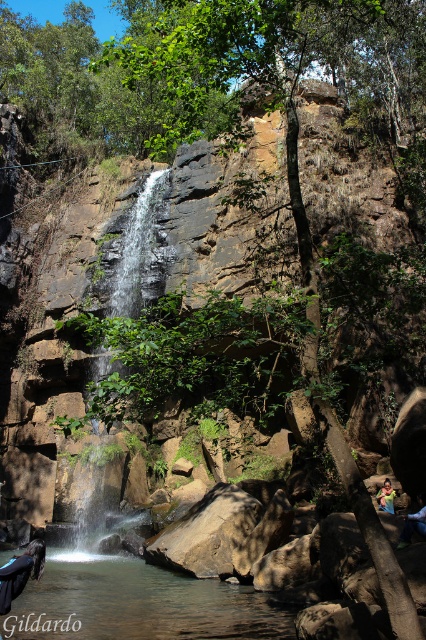
Question: Based on their relative distances, which object is nearer to the blue denim shorts at lower right?

Choices:
 (A) smooth rock waterfall at center
 (B) dark blue fabric at center

Answer: (B)

Question: Among these points, which one is farthest from the camera?

Choices:
 (A) (382, 492)
 (B) (36, 611)
 (C) (20, 557)
 (D) (416, 515)

Answer: (A)

Question: Can you confirm if clear water at center is bigger than smooth rock waterfall at center?

Choices:
 (A) no
 (B) yes

Answer: (A)

Question: Among these points, which one is farthest from the camera?

Choices:
 (A) (422, 522)
 (B) (69, 538)
 (C) (89, 595)

Answer: (B)

Question: Can you confirm if smooth rock waterfall at center is positioned to the right of blue denim shorts at lower right?

Choices:
 (A) yes
 (B) no

Answer: (B)

Question: Observing the image, what is the correct spatial positioning of smooth rock waterfall at center in reference to blue denim shorts at lower right?

Choices:
 (A) left
 (B) right

Answer: (A)